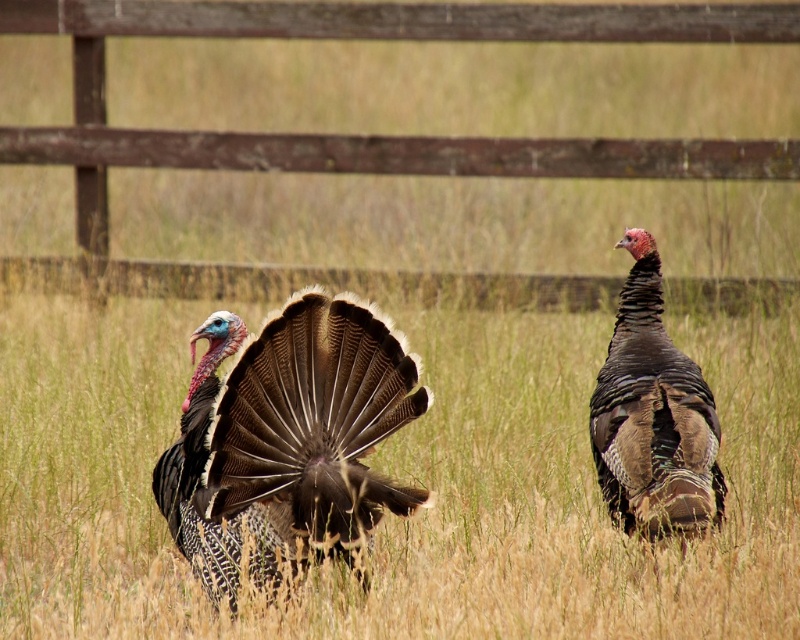
Is wooden fence at upper center to the left of dark brown feathers at right from the viewer's perspective?

Correct, you'll find wooden fence at upper center to the left of dark brown feathers at right.

Who is more forward, (104, 67) or (612, 378)?

Point (612, 378) is in front.

Measure the distance between point (289, 163) and camera.

They are 8.84 meters apart.

Where is `wooden fence at upper center`? wooden fence at upper center is located at coordinates (356, 134).

Which is more to the right, shiny brown turkey at center or dark brown feathers at right?

From the viewer's perspective, dark brown feathers at right appears more on the right side.

From the picture: Does shiny brown turkey at center appear over dark brown feathers at right?

Yes, shiny brown turkey at center is above dark brown feathers at right.

Is point (270, 381) closer to camera compared to point (628, 232)?

Yes, it is.

Locate an element on the screen. Image resolution: width=800 pixels, height=640 pixels. shiny brown turkey at center is located at coordinates (288, 442).

Does wooden fence at upper center have a smaller size compared to shiny brown turkey at center?

No.

Is point (632, 161) farther from viewer compared to point (224, 586)?

Yes, point (632, 161) is farther from viewer.

Who is more forward, (542, 305) or (189, 467)?

Point (189, 467) is more forward.

I want to click on wooden fence at upper center, so click(x=356, y=134).